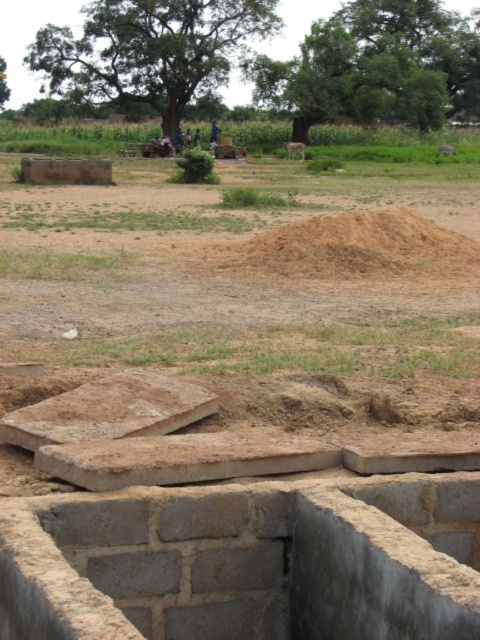
From the picture: Between gray brick foundation at lower center and brown sandy mound at center, which one is positioned higher?

brown sandy mound at center

Is point (204, 625) positioned in front of point (408, 212)?

That is True.

This screenshot has width=480, height=640. Find the location of `gray brick foundation at lower center`. gray brick foundation at lower center is located at coordinates (247, 561).